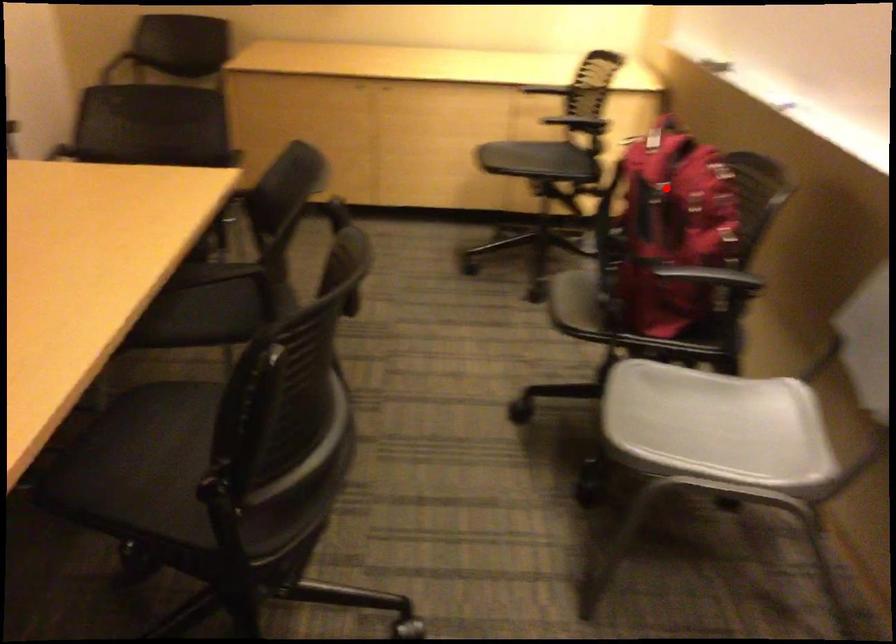
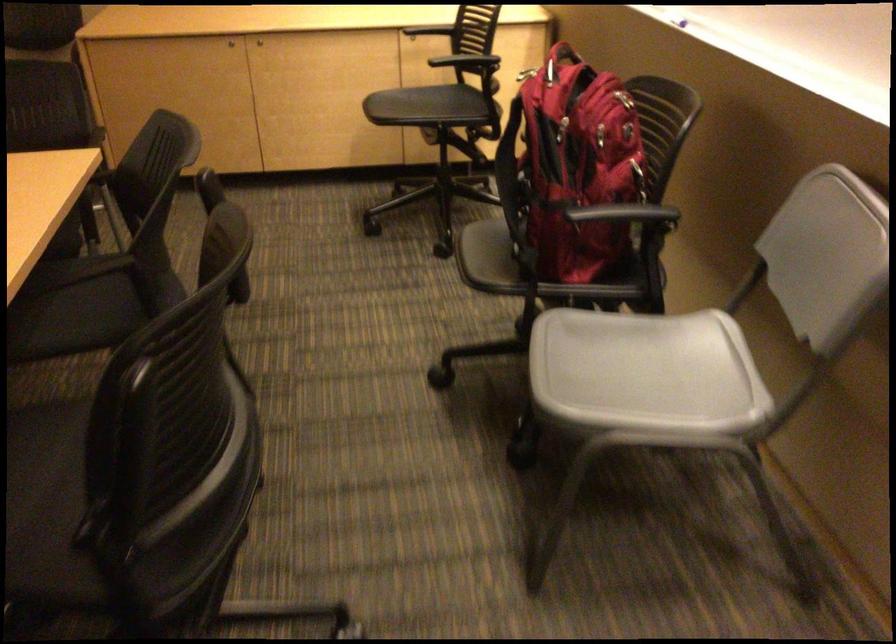
Find the pixel in the second image that matches the highlighted location in the first image.

(564, 127)